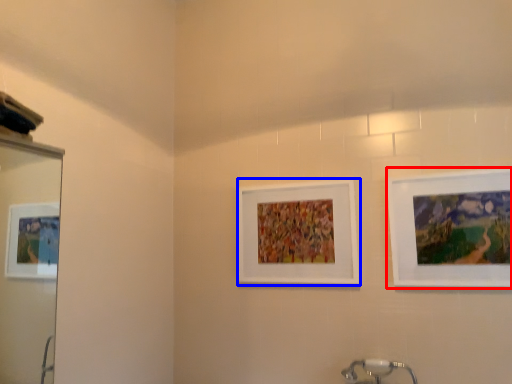
Question: Which object is closer to the camera taking this photo, picture frame (highlighted by a red box) or picture frame (highlighted by a blue box)?

Choices:
 (A) picture frame
 (B) picture frame

Answer: (A)